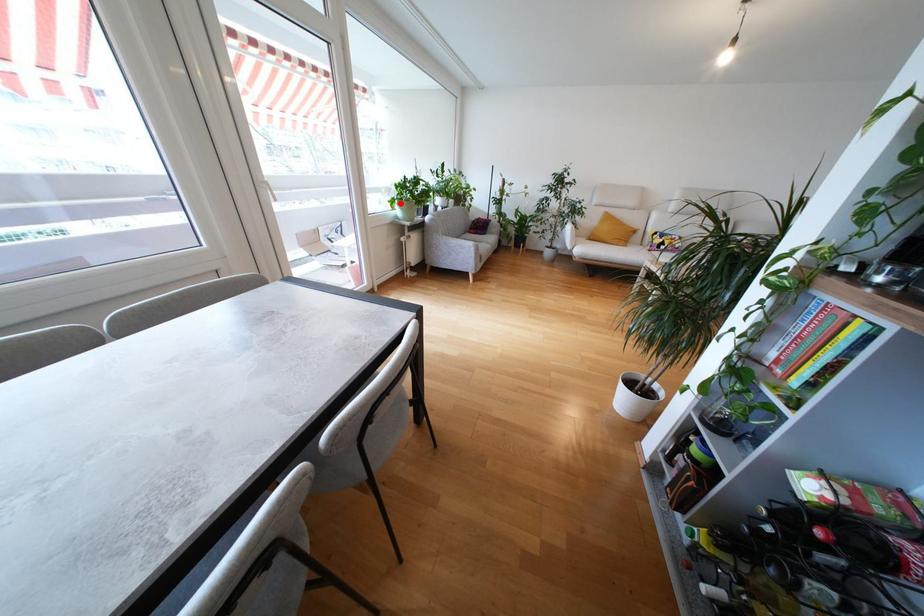
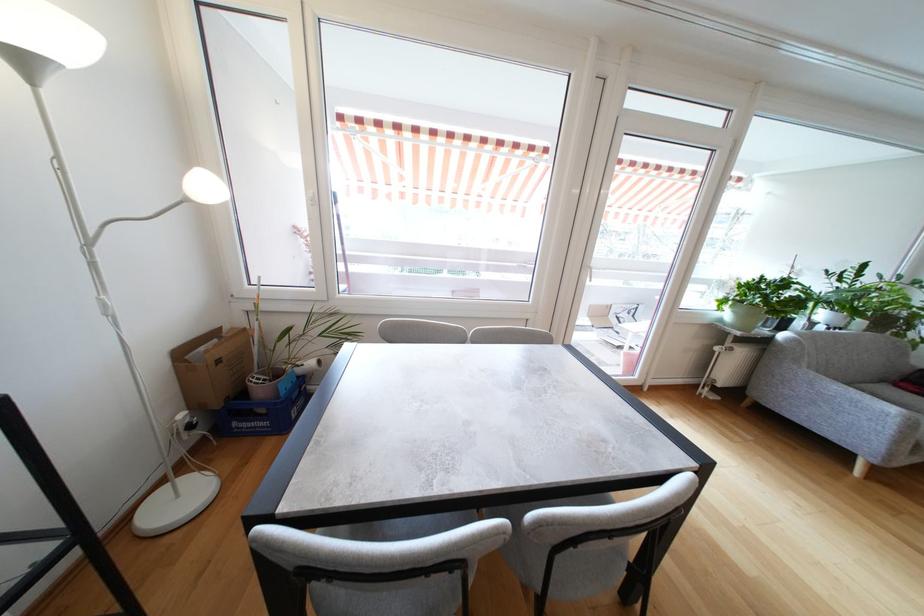
Question: I am providing you with two images of the same scene from different viewpoints. A red point is shown in image1. For the corresponding object point in image2, is it positioned nearer or farther from the camera?

Choices:
 (A) Nearer
 (B) Farther

Answer: (B)